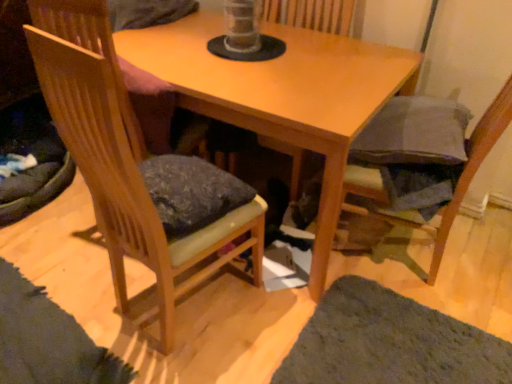
Question: Can we say wooden chair at left, which appears as the 2th chair when viewed from the right, lies outside wooden table at center?

Choices:
 (A) yes
 (B) no

Answer: (A)

Question: Is wooden chair at left, which appears as the 2th chair when viewed from the right, closer to the viewer compared to wooden table at center?

Choices:
 (A) no
 (B) yes

Answer: (B)

Question: Does wooden chair at left, acting as the first chair starting from the left, have a greater height compared to wooden table at center?

Choices:
 (A) no
 (B) yes

Answer: (B)

Question: From the image's perspective, is wooden chair at left, acting as the first chair starting from the left, above wooden table at center?

Choices:
 (A) yes
 (B) no

Answer: (B)

Question: Would you say wooden chair at left, acting as the first chair starting from the left, contains wooden table at center?

Choices:
 (A) yes
 (B) no

Answer: (B)

Question: Considering the positions of point (148, 216) and point (271, 6), is point (148, 216) closer or farther from the camera than point (271, 6)?

Choices:
 (A) farther
 (B) closer

Answer: (B)

Question: Is wooden chair at left, which appears as the 2th chair when viewed from the right, taller or shorter than wooden swivel chair at center?

Choices:
 (A) short
 (B) tall

Answer: (B)

Question: Considering their positions, is wooden chair at left, which appears as the 2th chair when viewed from the right, located in front of or behind wooden swivel chair at center?

Choices:
 (A) behind
 (B) front

Answer: (B)

Question: Is wooden chair at left, acting as the first chair starting from the left, inside the boundaries of wooden swivel chair at center, or outside?

Choices:
 (A) inside
 (B) outside

Answer: (B)

Question: From their relative heights in the image, would you say dark gray fabric cushion at lower right, which is the 1th chair from right to left, is taller or shorter than wooden table at center?

Choices:
 (A) tall
 (B) short

Answer: (A)

Question: Would you say dark gray fabric cushion at lower right, which is the 1th chair from right to left, is to the left or to the right of wooden table at center in the picture?

Choices:
 (A) left
 (B) right

Answer: (B)

Question: Do you think dark gray fabric cushion at lower right, which is the 1th chair from right to left, is within wooden table at center, or outside of it?

Choices:
 (A) inside
 (B) outside

Answer: (B)

Question: Looking at the image, does dark gray fabric cushion at lower right, acting as the 2th chair starting from the left, seem bigger or smaller compared to wooden table at center?

Choices:
 (A) small
 (B) big

Answer: (A)

Question: Does point (506, 109) appear closer or farther from the camera than point (468, 337)?

Choices:
 (A) closer
 (B) farther

Answer: (A)

Question: Do you think dark gray fabric cushion at lower right, acting as the 2th chair starting from the left, is within green shaggy rug at lower right, or outside of it?

Choices:
 (A) inside
 (B) outside

Answer: (B)